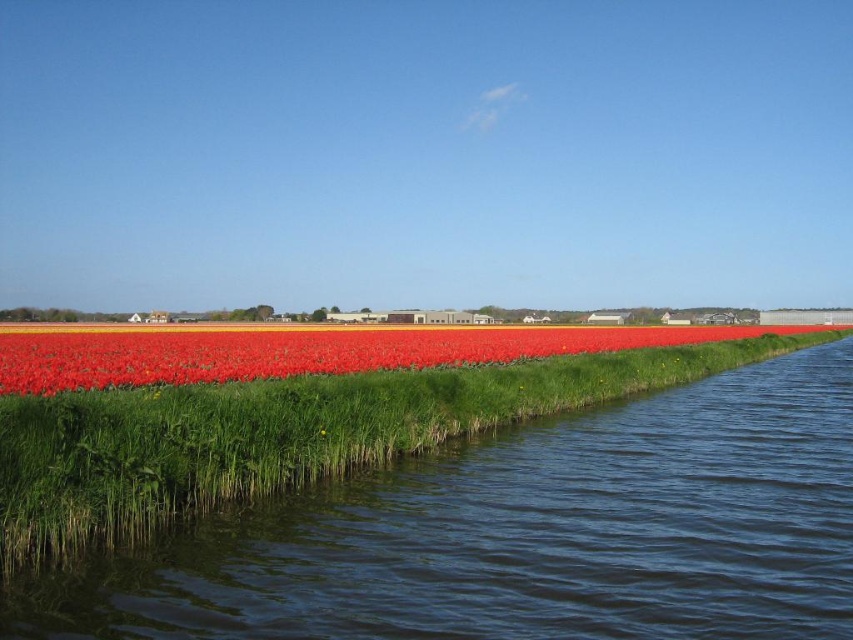
You are standing at the edge of the red tulip field and see the point marked at coordinates (521, 532). What is located at that point?

The point at coordinates (521, 532) indicates dark blue water at lower center.